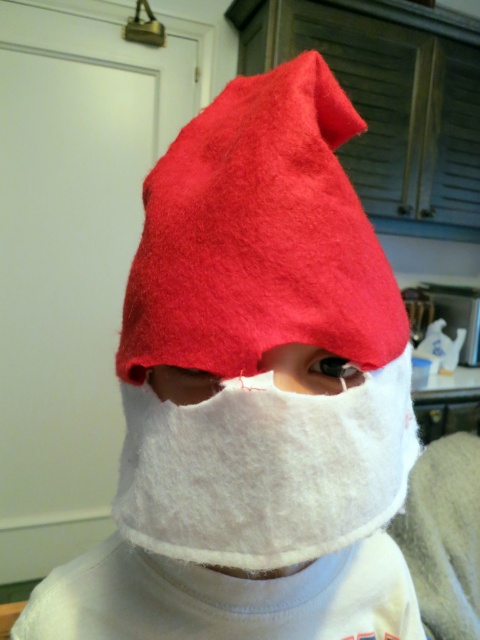
Is matte felt hat at upper center further to camera compared to white felt mask at center?

Yes, it is behind white felt mask at center.

The image size is (480, 640). Describe the element at coordinates (259, 237) in the screenshot. I see `matte felt hat at upper center` at that location.

You are a GUI agent. You are given a task and a screenshot of the screen. Output one action in this format:
    pyautogui.click(x=<x>, y=<y>)
    Task: Click on the matte felt hat at upper center
    
    Given the screenshot: What is the action you would take?
    pyautogui.click(x=259, y=237)

Is matte felt hat at upper center to the right of white soft fabric at center from the viewer's perspective?

Answer: Yes, matte felt hat at upper center is to the right of white soft fabric at center.

What do you see at coordinates (259, 237) in the screenshot? This screenshot has width=480, height=640. I see `matte felt hat at upper center` at bounding box center [259, 237].

Image resolution: width=480 pixels, height=640 pixels. I want to click on matte felt hat at upper center, so click(259, 237).

You are a GUI agent. You are given a task and a screenshot of the screen. Output one action in this format:
    pyautogui.click(x=<x>, y=<y>)
    Task: Click on the matte felt hat at upper center
    
    Given the screenshot: What is the action you would take?
    pyautogui.click(x=259, y=237)

Is white felt mask at center shorter than white soft fabric at center?

No.

Is point (331, 417) positioned in front of point (324, 355)?

Yes.

Find the location of a particular element. This screenshot has height=640, width=480. white felt mask at center is located at coordinates (264, 468).